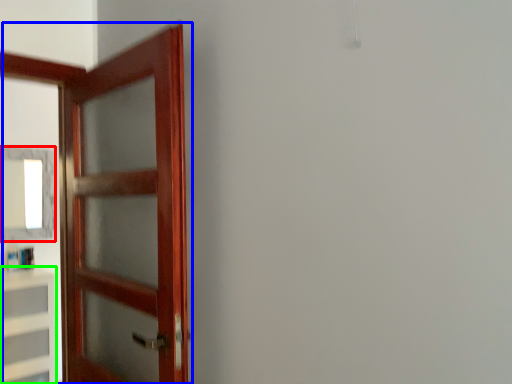
Question: Estimate the real-world distances between objects in this image. Which object is farther from mirror (highlighted by a red box), door (highlighted by a blue box) or cabinetry (highlighted by a green box)?

Choices:
 (A) door
 (B) cabinetry

Answer: (A)